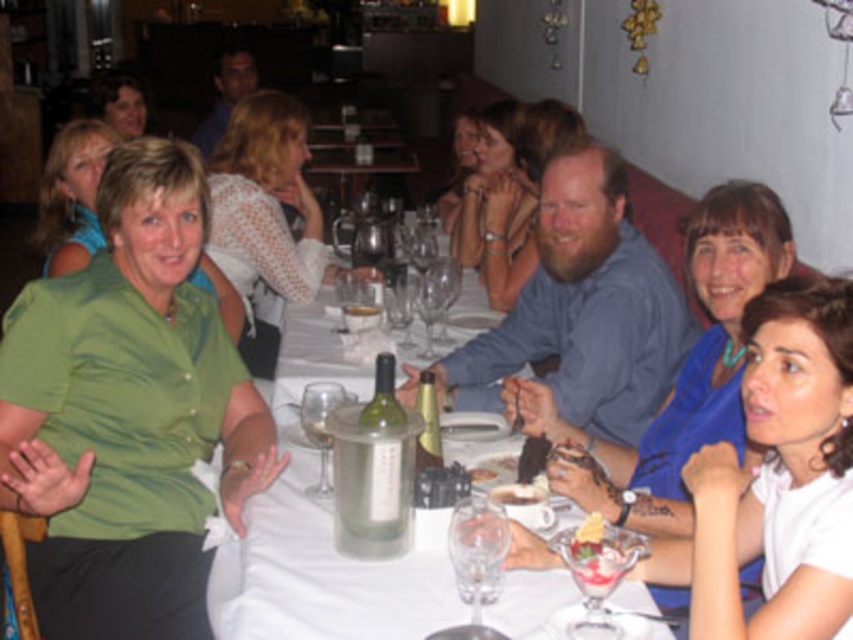
You are a guest at the table and want to reach for the smooth chocolate cake at lower center. Is the clear glass wine glass at center blocking your direct path to the cake?

The clear glass wine glass at center is in front of the smooth chocolate cake at lower center, so it is blocking the direct path to the cake.

You are a server at the restaurant and need to place a dessert plate between the clear glass wine glass at lower center and the clear glass wine glass at center. Which wine glass has a larger width to ensure the dessert plate fits properly?

The clear glass wine glass at lower center has a larger width than the clear glass wine glass at center, so the dessert plate should be placed next to it to ensure proper fit.

You are a server at the restaurant and need to determine which wine glass to use for the next course. The next course requires a larger wine glass. Which one should you choose between the clear glass wine glass at lower center and the clear glass wine glass at center?

The clear glass wine glass at center is larger than the clear glass wine glass at lower center, so you should choose the clear glass wine glass at center for the next course.